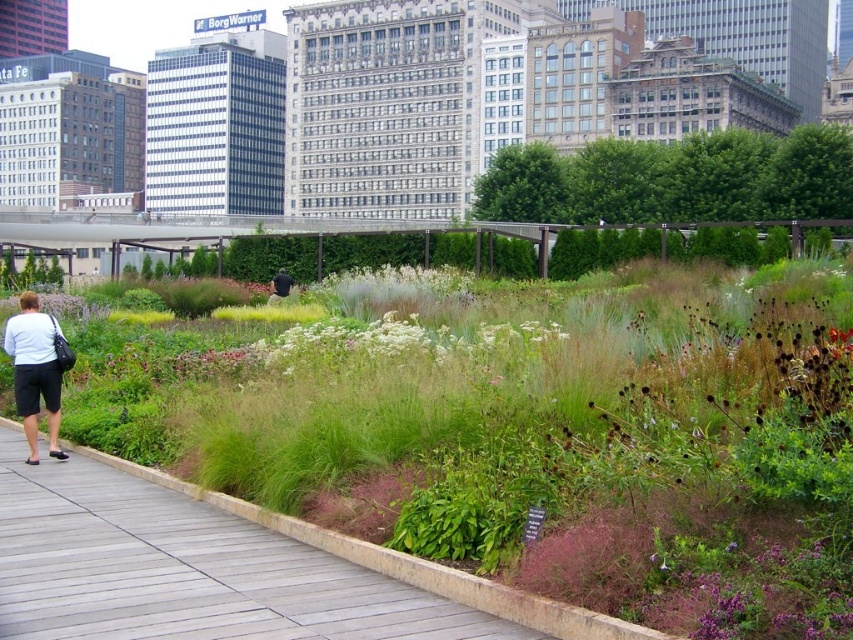
Question: Which object appears farthest from the camera in this image?

Choices:
 (A) wooden at left
 (B) white matte shorts at left
 (C) black fabric at center
 (D) white fluffy plant at center

Answer: (C)

Question: Considering the relative positions of white matte shorts at left and black fabric at center in the image provided, where is white matte shorts at left located with respect to black fabric at center?

Choices:
 (A) right
 (B) left

Answer: (B)

Question: Does wooden at left appear under white fluffy plant at center?

Choices:
 (A) no
 (B) yes

Answer: (B)

Question: Which of the following is the farthest from the observer?

Choices:
 (A) white fluffy plant at center
 (B) white matte shorts at left
 (C) wooden at left

Answer: (A)

Question: Among these objects, which one is farthest from the camera?

Choices:
 (A) green grass at center
 (B) black fabric at center

Answer: (B)

Question: Is wooden at left to the left of white fluffy plant at center from the viewer's perspective?

Choices:
 (A) yes
 (B) no

Answer: (A)